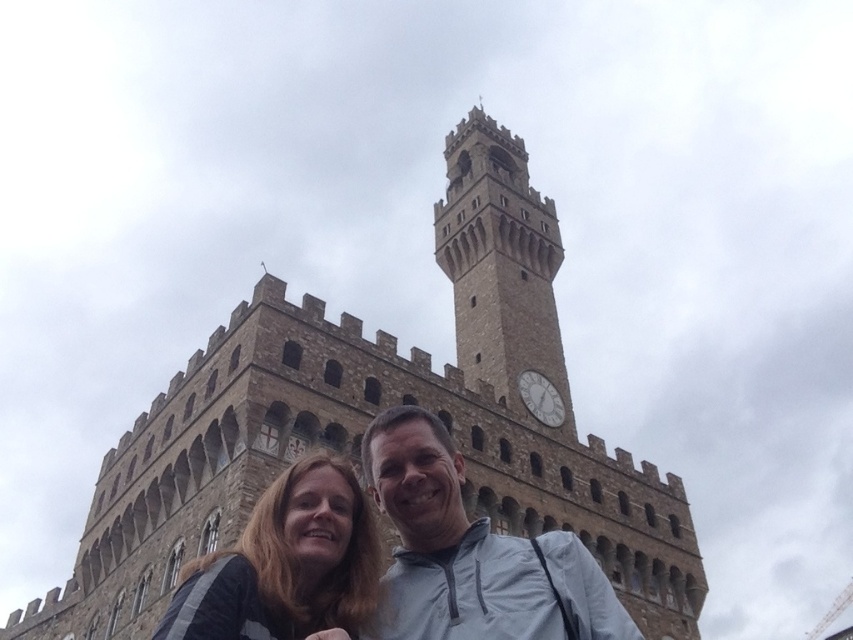
You are taking a photo of the brown stone tower at center and the matte gray jacket at center. Which object should you focus on first if you want to capture both clearly in the same frame?

The brown stone tower at center is larger in size than the matte gray jacket at center, so you should focus on the brown stone tower at center first to ensure it is in sharp focus before adjusting for the smaller matte gray jacket at center.

You are standing in front of a historic building with a brown stone tower at center. If you want to take a photo that includes both the tower and a person standing 10 meters in front of you, would the person be closer to or farther from the tower compared to your current position?

The person standing 10 meters in front of you would be 26.00 meters away from the brown stone tower at center, which is closer than your current position at 36.00 meters.